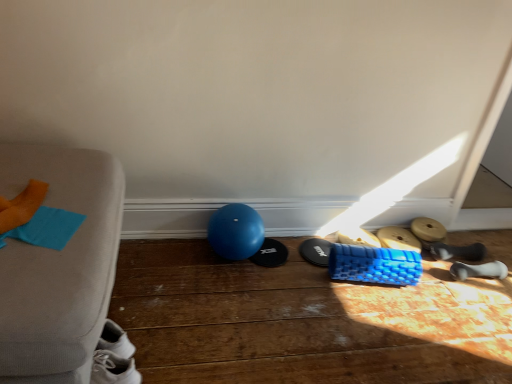
Question: In terms of width, does blue textured foam roller at lower right, which is counted as the fourth footwear, starting from the right, look wider or thinner when compared to wooden dumbbell at lower right, which appears as the fifth footwear when viewed from the left?

Choices:
 (A) thin
 (B) wide

Answer: (B)

Question: Would you say blue textured foam roller at lower right, which is counted as the fourth footwear, starting from the right, is inside or outside wooden dumbbell at lower right, which appears as the fifth footwear when viewed from the left?

Choices:
 (A) outside
 (B) inside

Answer: (A)

Question: Which object is the closest to the white rubber dumbbell at lower right, which is the 1th footwear from right to left?

Choices:
 (A) black rubber shoe at lower right, the 6th footwear viewed from the left
 (B) blue textured foam roller at lower right, the 4th footwear when ordered from left to right
 (C) blue textured foam roller at center, which is the fifth footwear from right to left
 (D) blue rubber ball at center
 (E) blue textured foam roller at center, which is the 6th footwear from right to left

Answer: (A)

Question: Which is nearer to the black rubber shoe at lower right, the 6th footwear viewed from the left?

Choices:
 (A) white rubber dumbbell at lower right, which is the 1th footwear from right to left
 (B) blue textured foam roller at center, which is the third footwear in left-to-right order
 (C) wooden dumbbell at lower right, which is the 3th footwear from right to left
 (D) blue textured foam roller at lower right, which is counted as the fourth footwear, starting from the right
 (E) blue textured foam roller at center, which is the 6th footwear from right to left

Answer: (C)